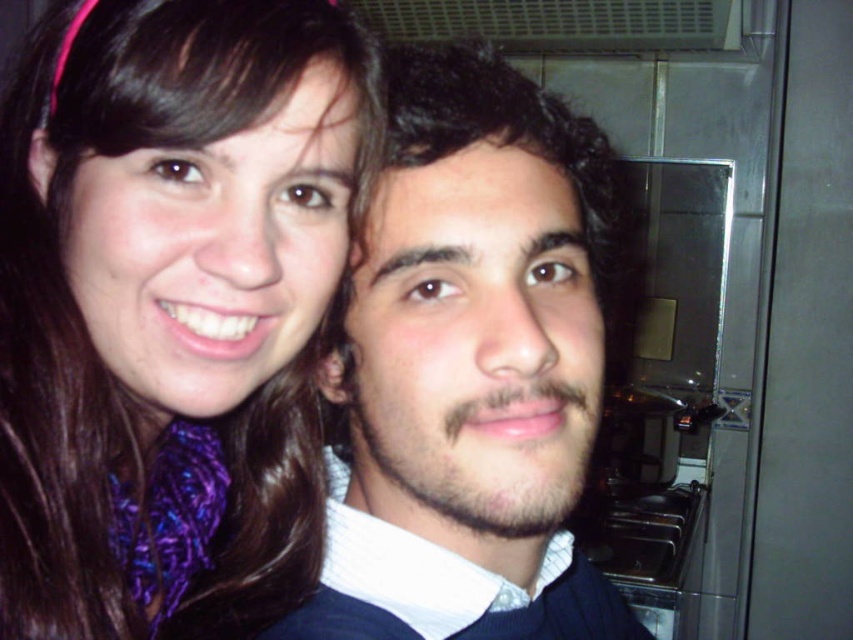
You are taking a photo of two people standing in a public space. You notice the purple silky scarf at upper left and the dark brown curly hair at center. Which object is positioned further to the left in the image?

The purple silky scarf at upper left is positioned further to the left compared to the dark brown curly hair at center, as it is located to the left of it.